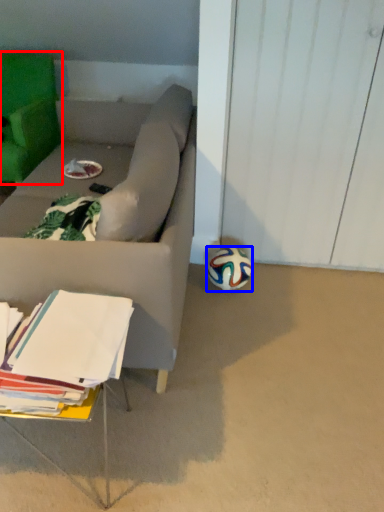
Question: Which object is closer to the camera taking this photo, chair (highlighted by a red box) or ball (highlighted by a blue box)?

Choices:
 (A) chair
 (B) ball

Answer: (B)